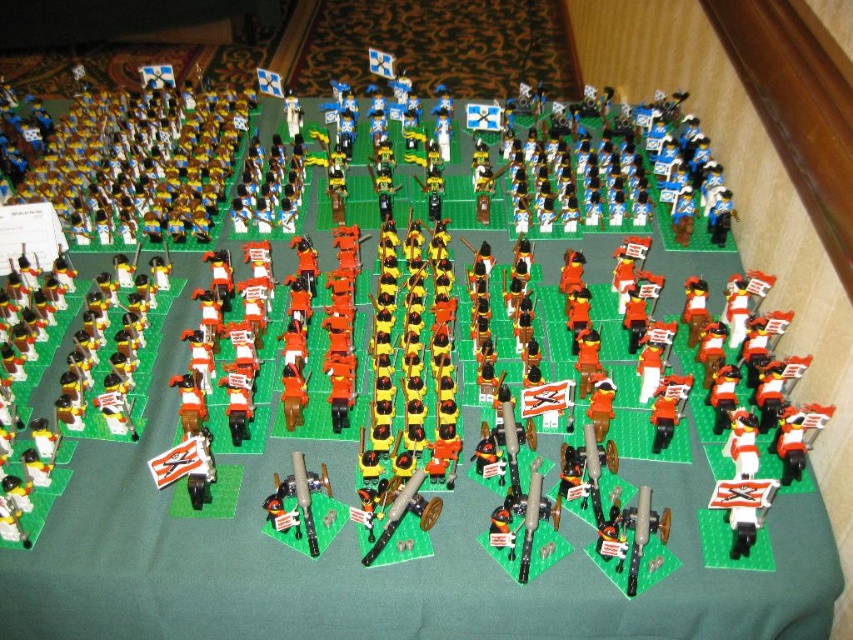
Question: Does wooden cannon at center appear under metallic cannon at center?

Choices:
 (A) yes
 (B) no

Answer: (B)

Question: Does wooden cannon at center have a lesser width compared to white matte flag at lower left?

Choices:
 (A) no
 (B) yes

Answer: (A)

Question: Which of the following is the farthest from the observer?

Choices:
 (A) (428, 529)
 (B) (297, 458)
 (C) (189, 492)

Answer: (C)

Question: Is metallic cannon at center positioned at the back of white matte flag at lower left?

Choices:
 (A) no
 (B) yes

Answer: (B)

Question: Which object is farther from the camera taking this photo?

Choices:
 (A) metallic cannon at center
 (B) white matte flag at lower left
 (C) wooden cannon at center

Answer: (A)

Question: Which of the following is the farthest from the observer?

Choices:
 (A) wooden cannon at center
 (B) metallic cannon at center

Answer: (B)